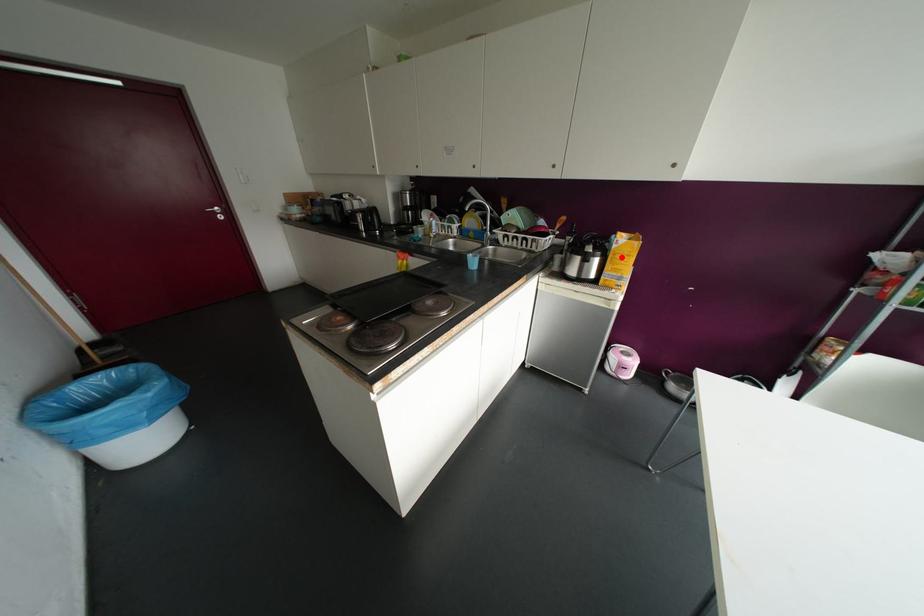
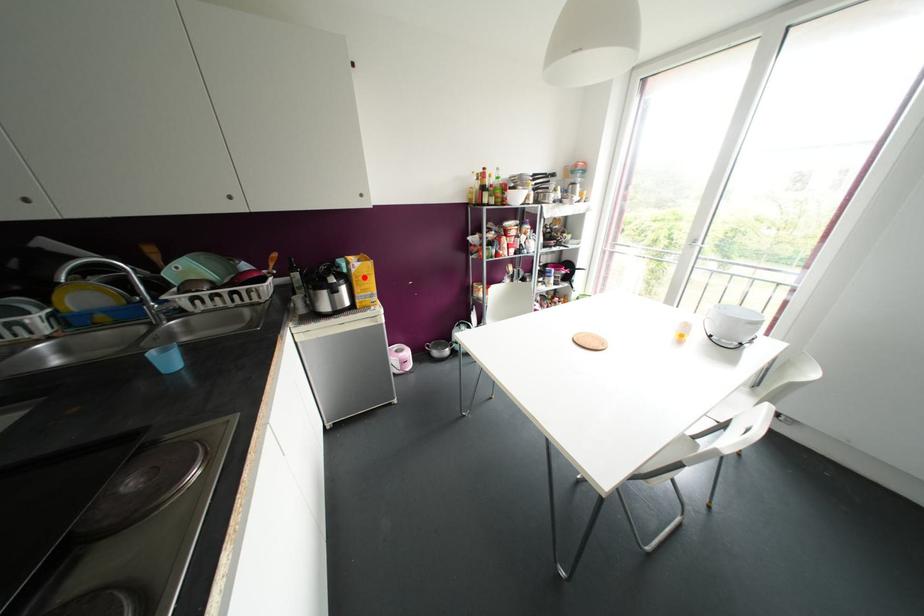
I am providing you with two images of the same scene from different viewpoints. A red point is marked on the first image and another point is marked on the second image. Are the points marked in image1 and image2 representing the same 3D position?

Yes